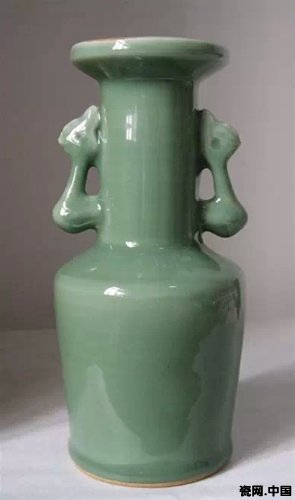
You are a GUI agent. You are given a task and a screenshot of the screen. Output one action in this format:
    pyautogui.click(x=<x>, y=<y>)
    Task: Click on the green vase
    
    Given the screenshot: What is the action you would take?
    pyautogui.click(x=156, y=196)